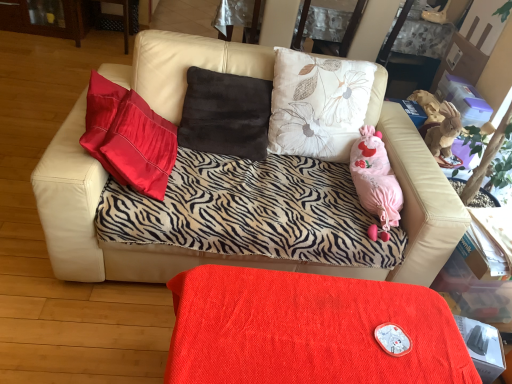
Question: Choose the correct answer: Is velvet red table at lower center inside zebra-patterned fabric couch at center or outside it?

Choices:
 (A) outside
 (B) inside

Answer: (A)

Question: In the image, is velvet red table at lower center on the left side or the right side of zebra-patterned fabric couch at center?

Choices:
 (A) left
 (B) right

Answer: (B)

Question: From a real-world perspective, is velvet red table at lower center above or below zebra-patterned fabric couch at center?

Choices:
 (A) above
 (B) below

Answer: (B)

Question: Is zebra-patterned fabric couch at center inside the boundaries of velvet red table at lower center, or outside?

Choices:
 (A) outside
 (B) inside

Answer: (A)

Question: From a real-world perspective, relative to velvet red table at lower center, is zebra-patterned fabric couch at center vertically above or below?

Choices:
 (A) above
 (B) below

Answer: (A)

Question: Is point 404,155 positioned closer to the camera than point 282,352?

Choices:
 (A) closer
 (B) farther

Answer: (B)

Question: Considering the positions of zebra-patterned fabric couch at center and velvet red table at lower center in the image, is zebra-patterned fabric couch at center wider or thinner than velvet red table at lower center?

Choices:
 (A) thin
 (B) wide

Answer: (B)